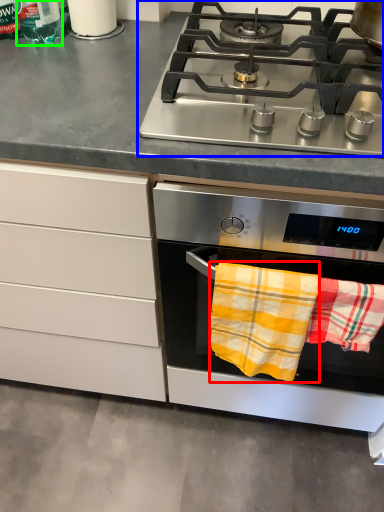
Question: Which object is the closest to the beach towel (highlighted by a red box)? Choose among these: gas stove (highlighted by a blue box) or bottle (highlighted by a green box).

Choices:
 (A) gas stove
 (B) bottle

Answer: (A)